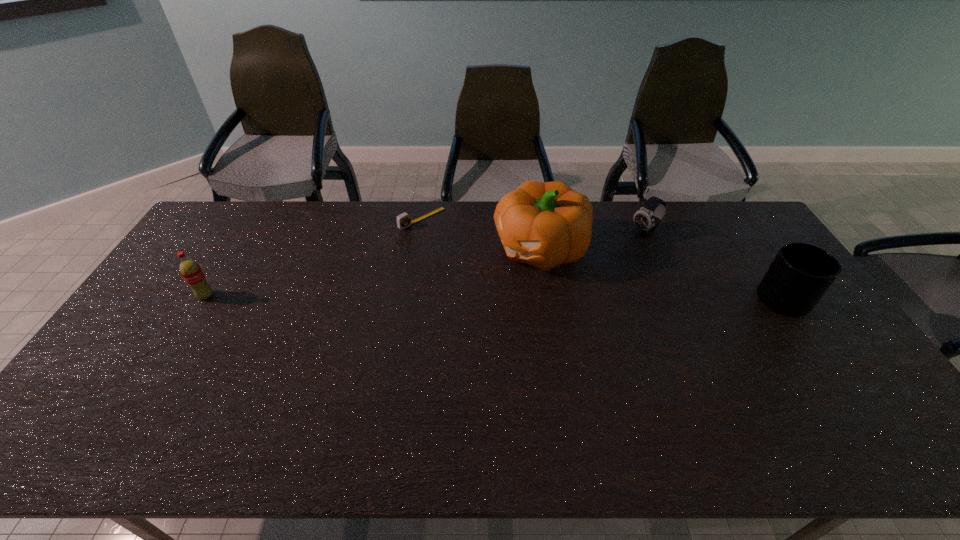
Locate an element on the screen. This screenshot has width=960, height=540. free point located 0.080m on the carved face of the pumpkin is located at coordinates (485, 279).

The height and width of the screenshot is (540, 960). Identify the location of vacant region located on the carved face of the pumpkin. (417, 315).

Find the location of a particular element. vacant space located 0.180m at the front of the shortest object with the tape extended is located at coordinates (466, 253).

You are a GUI agent. You are given a task and a screenshot of the screen. Output one action in this format:
    pyautogui.click(x=<x>, y=<y>)
    Task: Click on the vacant space positioned at the front of the shortest object with the tape extended
    The width and height of the screenshot is (960, 540).
    Given the screenshot: What is the action you would take?
    pyautogui.click(x=492, y=273)

At what (x,y) coordinates should I click in order to perform the action: click on vacant space located 0.390m at the front of the shortest object with the tape extended. Please return your answer as a coordinate pair (x, y). This screenshot has width=960, height=540. Looking at the image, I should click on (508, 287).

What are the coordinates of `vacant space located 0.270m on the face of the second object from right to left` in the screenshot? It's located at (585, 271).

The width and height of the screenshot is (960, 540). In order to click on free space located 0.400m on the face of the second object from right to left in this screenshot , I will do `click(556, 289)`.

The image size is (960, 540). What are the coordinates of `vacant space located 0.310m on the face of the second object from right to left` in the screenshot? It's located at (576, 276).

You are a GUI agent. You are given a task and a screenshot of the screen. Output one action in this format:
    pyautogui.click(x=<x>, y=<y>)
    Task: Click on the pumpkin located at the far edge
    Image resolution: width=960 pixels, height=540 pixels.
    Given the screenshot: What is the action you would take?
    pyautogui.click(x=544, y=224)

You are a GUI agent. You are given a task and a screenshot of the screen. Output one action in this format:
    pyautogui.click(x=<x>, y=<y>)
    Task: Click on the tape measure at the far edge
    
    Given the screenshot: What is the action you would take?
    pyautogui.click(x=403, y=220)